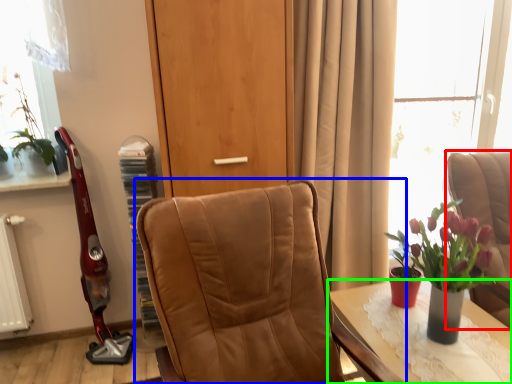
Question: Estimate the real-world distances between objects in this image. Which object is farther from chair (highlighted by a red box), chair (highlighted by a blue box) or table (highlighted by a green box)?

Choices:
 (A) chair
 (B) table

Answer: (A)